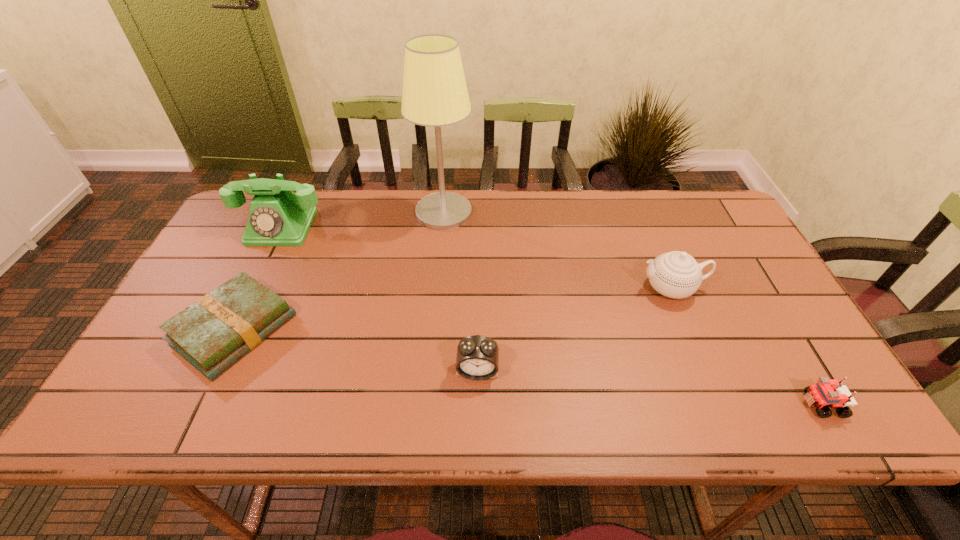
Locate an element on the screen. This screenshot has width=960, height=540. table lamp is located at coordinates (435, 94).

Find the location of a particular element. the fifth shortest object is located at coordinates (277, 217).

At what (x,y) coordinates should I click in order to perform the action: click on the fifth object from left to right. Please return your answer as a coordinate pair (x, y). Image resolution: width=960 pixels, height=540 pixels. Looking at the image, I should click on (675, 274).

You are a GUI agent. You are given a task and a screenshot of the screen. Output one action in this format:
    pyautogui.click(x=<x>, y=<y>)
    Task: Click on the alarm clock
    
    Given the screenshot: What is the action you would take?
    pyautogui.click(x=477, y=358)

Where is `the rightmost object`? Image resolution: width=960 pixels, height=540 pixels. the rightmost object is located at coordinates (826, 393).

Identify the location of the nearest object. This screenshot has height=540, width=960. (826, 393).

Where is `book`? book is located at coordinates (213, 333).

Image resolution: width=960 pixels, height=540 pixels. I want to click on vacant space situated 0.220m on the right of the table lamp, so click(541, 212).

Locate an element on the screen. free space located on the dial of the telephone is located at coordinates (249, 295).

This screenshot has height=540, width=960. In order to click on free location located on the spout of the chinaware in this screenshot , I will do `click(556, 288)`.